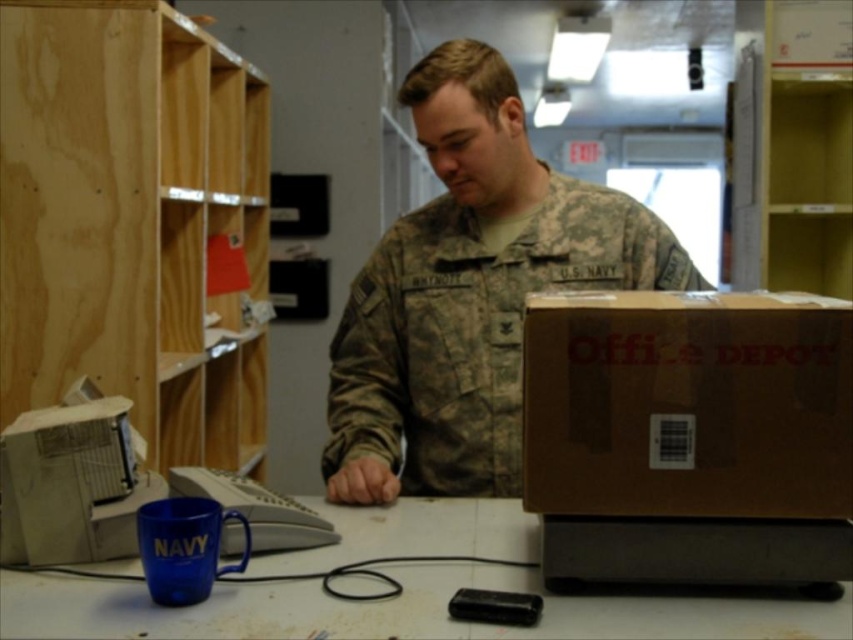
Does brown cardboard box at right appear on the left side of blue plastic cup at lower left?

In fact, brown cardboard box at right is to the right of blue plastic cup at lower left.

Between brown cardboard box at right and blue plastic cup at lower left, which one has more height?

brown cardboard box at right is taller.

I want to click on brown cardboard box at right, so click(688, 404).

Where is `brown cardboard box at right`? brown cardboard box at right is located at coordinates click(688, 404).

Does brown cardboard box at right have a larger size compared to blue plastic cup at lower center?

Actually, brown cardboard box at right might be smaller than blue plastic cup at lower center.

Find the location of a particular element. Image resolution: width=853 pixels, height=640 pixels. brown cardboard box at right is located at coordinates (688, 404).

Does camouflage uniform at center lie behind brown cardboard box at right?

Yes, camouflage uniform at center is further from the viewer.

Is point (457, 72) farther from camera compared to point (781, 372)?

That is True.

The width and height of the screenshot is (853, 640). Identify the location of camouflage uniform at center. (469, 291).